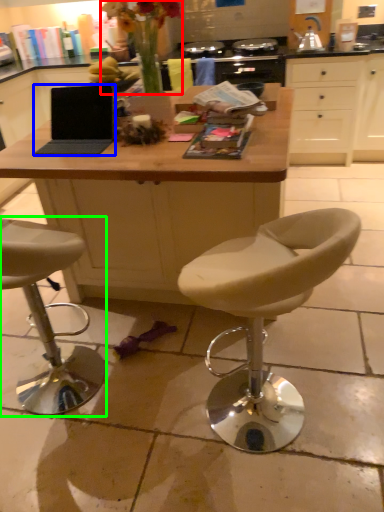
Question: Which object is the closest to the floral arrangement (highlighted by a red box)? Choose among these: laptop (highlighted by a blue box) or chair (highlighted by a green box).

Choices:
 (A) laptop
 (B) chair

Answer: (A)